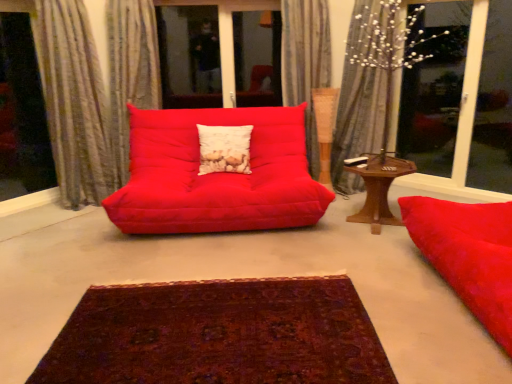
Identify the location of vacant area that lies between matte red studio couch at center, which is the second studio couch in right-to-left order, and deep burgundy woven rug at center. This screenshot has width=512, height=384. (x=209, y=260).